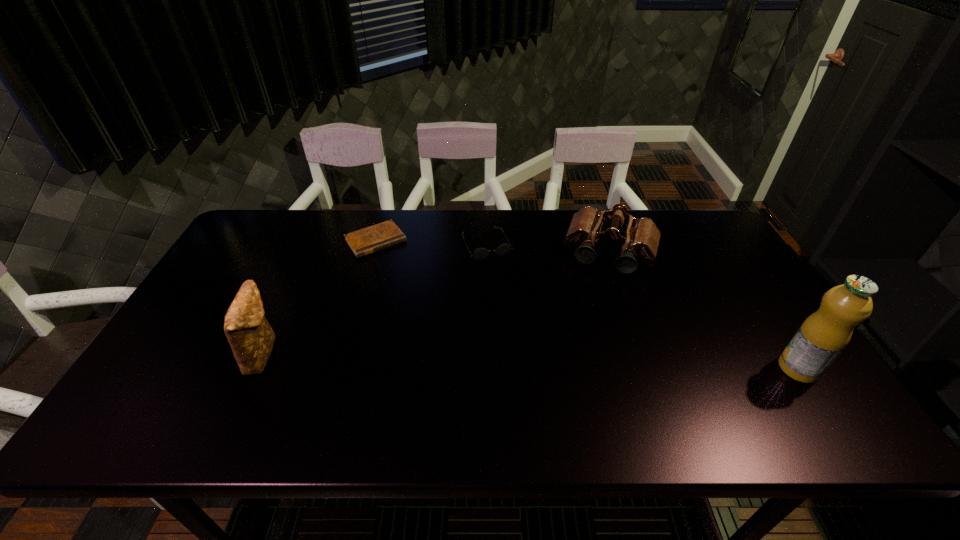
Find the location of `free space at the far edge`. free space at the far edge is located at coordinates tap(306, 214).

Locate an element on the screen. vacant space at the near edge of the desktop is located at coordinates (666, 368).

Find the location of a particular element. This screenshot has width=960, height=540. vacant space at the right edge of the desktop is located at coordinates (718, 316).

You are a GUI agent. You are given a task and a screenshot of the screen. Output one action in this format:
    pyautogui.click(x=<x>, y=<y>)
    Task: Click on the vacant point located between the shortest object and the sunglasses
    Image resolution: width=960 pixels, height=540 pixels.
    Given the screenshot: What is the action you would take?
    pyautogui.click(x=431, y=242)

The height and width of the screenshot is (540, 960). Find the location of `empty space between the tallest object and the third tallest object`. empty space between the tallest object and the third tallest object is located at coordinates (705, 311).

This screenshot has height=540, width=960. Find the location of `free point between the shortest object and the binoculars`. free point between the shortest object and the binoculars is located at coordinates (493, 247).

Locate an element on the screen. This screenshot has width=960, height=540. free spot between the third object from right to left and the second object from left to right is located at coordinates (431, 242).

Image resolution: width=960 pixels, height=540 pixels. I want to click on blank region between the shortest object and the second shortest object, so click(431, 242).

Locate an element on the screen. vacant point located between the second shortest object and the fourth shortest object is located at coordinates (375, 299).

At what (x,y) coordinates should I click in order to perform the action: click on vacant point located between the leftmost object and the second object from left to right. Please return your answer as a coordinate pair (x, y). Looking at the image, I should click on (320, 296).